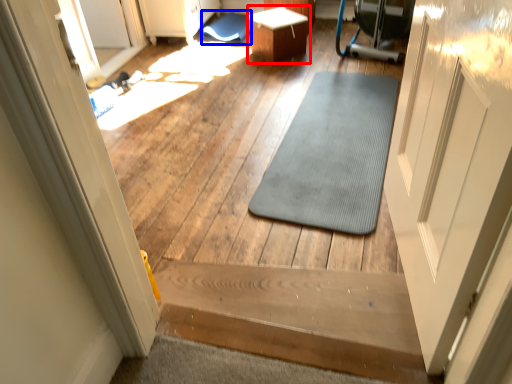
Question: Which object is further to the camera taking this photo, table (highlighted by a red box) or bath mat (highlighted by a blue box)?

Choices:
 (A) table
 (B) bath mat

Answer: (B)